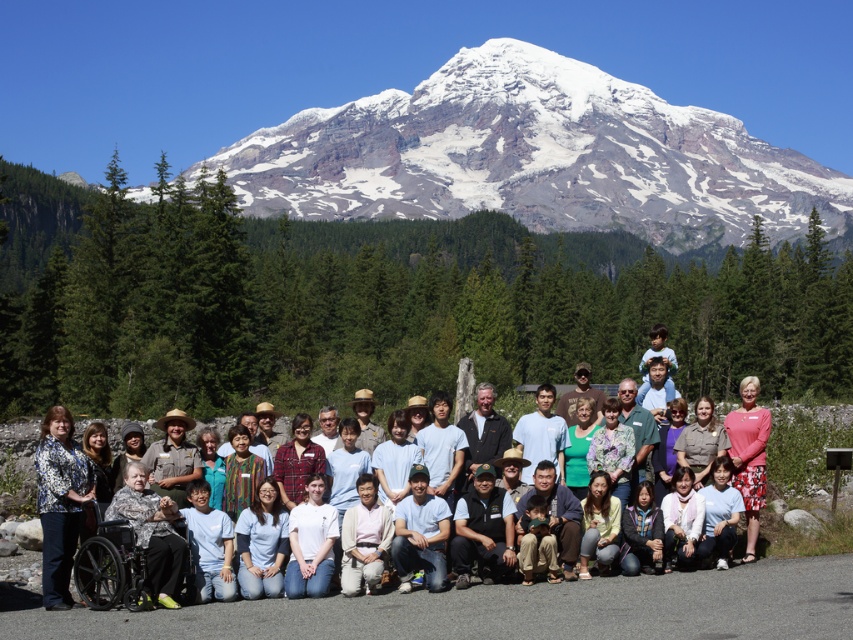
Question: Is floral-patterned blouse at lower left above black plastic wheelchair at lower left?

Choices:
 (A) no
 (B) yes

Answer: (B)

Question: Which of these objects is positioned closest to the black plastic wheelchair at lower left?

Choices:
 (A) white cotton shirt at center
 (B) light blue shirt at center
 (C) pink fabric dress at lower right

Answer: (A)

Question: Which point is closer to the camera?

Choices:
 (A) click(695, 374)
 (B) click(311, 573)
 (C) click(67, 556)

Answer: (C)

Question: Does light blue shirt at center have a larger size compared to light blue t-shirt at center?

Choices:
 (A) no
 (B) yes

Answer: (B)

Question: Can you confirm if snowy rock mountain at upper center is positioned to the left of floral-patterned blouse at lower left?

Choices:
 (A) no
 (B) yes

Answer: (A)

Question: Among these points, which one is nearest to the camera?

Choices:
 (A) (97, 576)
 (B) (479, 356)
 (C) (265, 531)

Answer: (A)